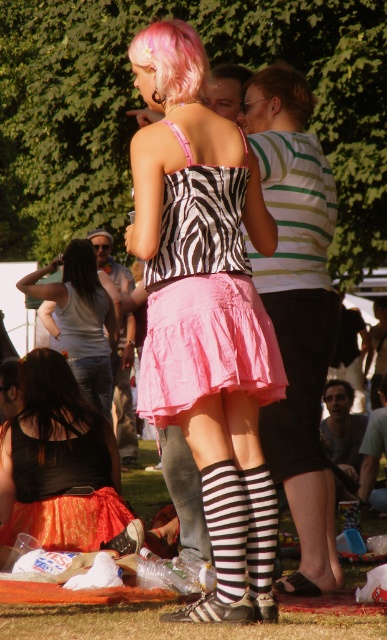
Question: Which point is closer to the camera taking this photo?

Choices:
 (A) [193, 65]
 (B) [306, 118]
 (C) [89, 243]

Answer: (A)

Question: Is brown dry grass at lower center positioned before pink satin skirt at lower center?

Choices:
 (A) no
 (B) yes

Answer: (B)

Question: Is pink satin skirt at center to the left of black shiny hair at lower left from the viewer's perspective?

Choices:
 (A) no
 (B) yes

Answer: (A)

Question: Does shiny orange skirt at lower left have a larger size compared to brown dry grass at lower center?

Choices:
 (A) no
 (B) yes

Answer: (B)

Question: Which point appears farthest from the camera in this image?

Choices:
 (A) (39, 362)
 (B) (171, 326)
 (C) (190, 51)
 (D) (306, 109)

Answer: (A)

Question: Which object appears closest to the camera in this image?

Choices:
 (A) brown dry grass at lower center
 (B) pink hair at upper center
 (C) pink satin skirt at center

Answer: (A)